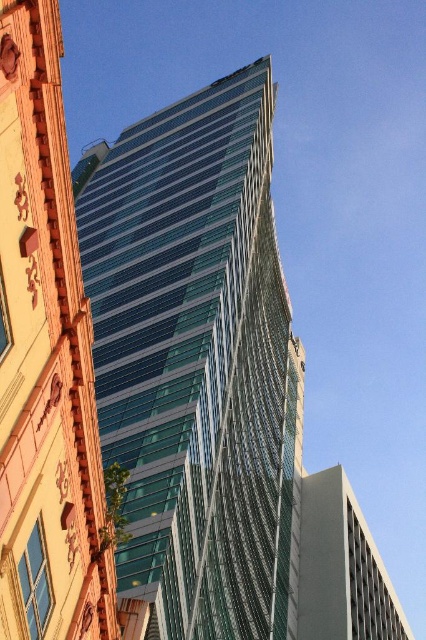
You are a city planner reviewing the architectural layout of the area. You need to determine the spatial relationship between the transparent glass tower at center and the transparent glass building at upper center. Which one is positioned to the right of the other?

The transparent glass tower at center is to the right of the transparent glass building at upper center.

You are an architect analyzing the spatial arrangement of the buildings in the image. Which of the two transparent structures, the transparent glass tower at center or the transparent glass building at upper center, is located higher up in the image?

The transparent glass tower at center is positioned over the transparent glass building at upper center, meaning it is higher up in the image.

Based on the photo, you are an architect analyzing the spatial relationship between the transparent glass tower at center and the transparent glass building at upper center in the image. Which of these two structures has a greater width?

The transparent glass tower at center has a greater width than the transparent glass building at upper center according to the description.